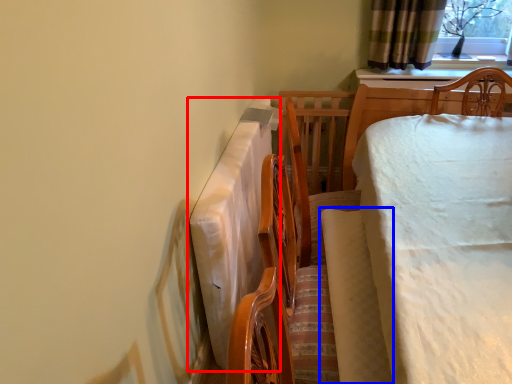
Question: Among these objects, which one is nearest to the camera, tablecloth (highlighted by a red box) or blanket (highlighted by a blue box)?

Choices:
 (A) tablecloth
 (B) blanket

Answer: (B)